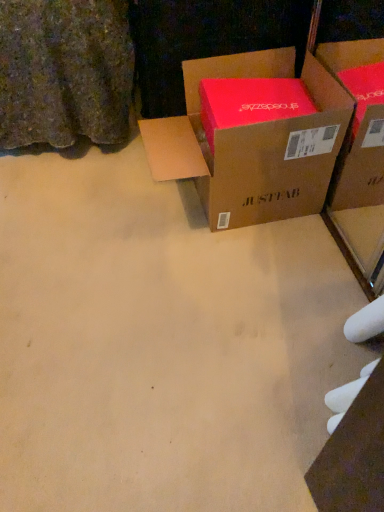
This screenshot has width=384, height=512. Describe the element at coordinates (253, 144) in the screenshot. I see `matte cardboard box at center` at that location.

This screenshot has height=512, width=384. I want to click on matte cardboard box at center, so click(x=253, y=144).

Where is `matte cardboard box at center`? The height and width of the screenshot is (512, 384). matte cardboard box at center is located at coordinates (253, 144).